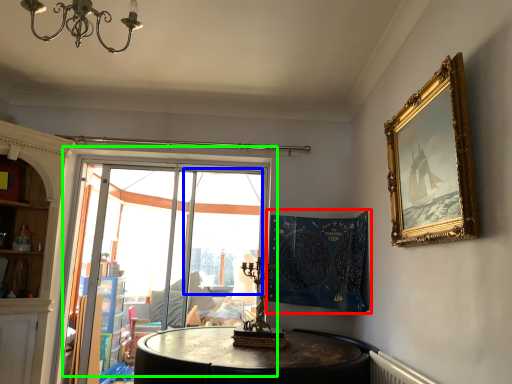
Question: Based on their relative distances, which object is farther from tapestry (highlighted by a red box)? Choose from window screen (highlighted by a blue box) and window (highlighted by a green box).

Choices:
 (A) window screen
 (B) window

Answer: (A)